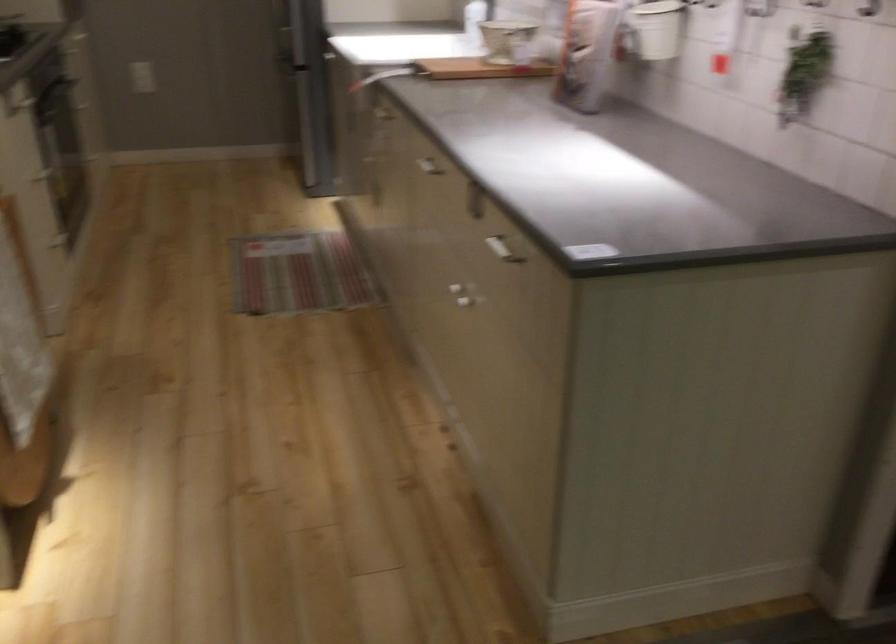
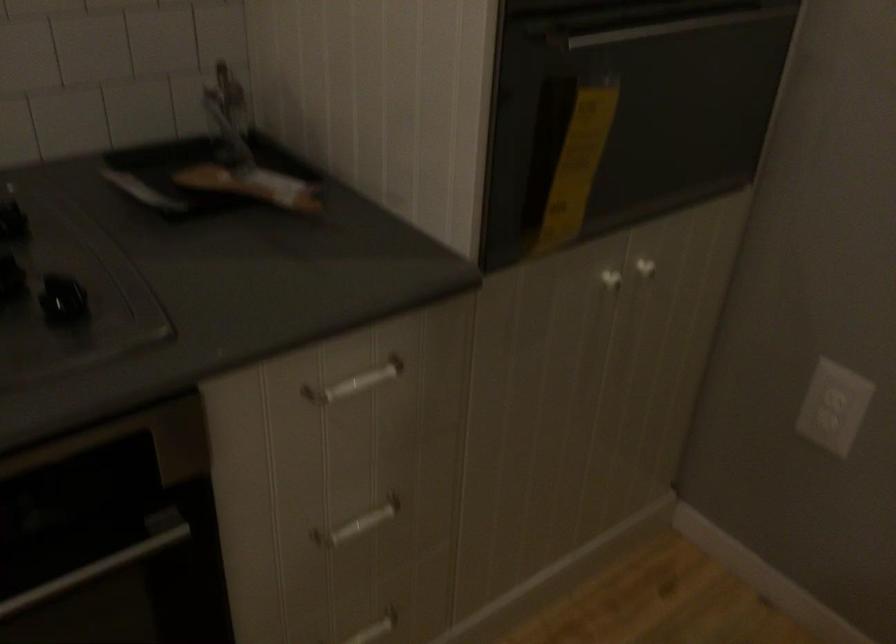
Locate, in the second image, the point that corresponds to point 105,165 in the first image.

(374, 629)